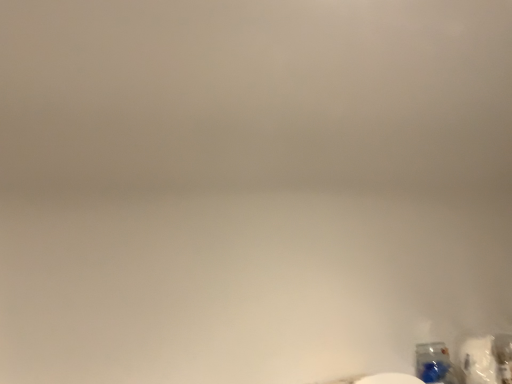
Question: Should I look upward or downward to see translucent plastic bottle at bottom right?

Choices:
 (A) up
 (B) down

Answer: (B)